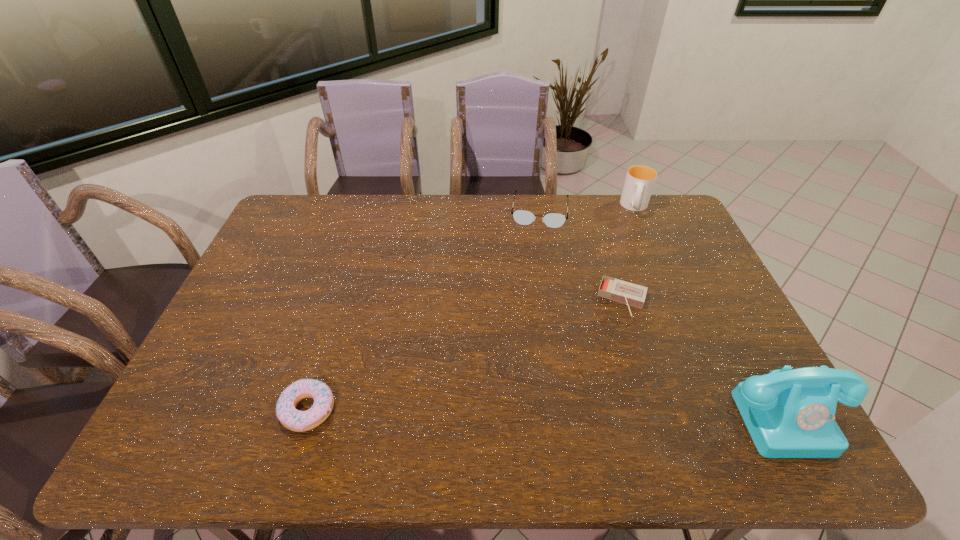
Where is `free space between the fourth shortest object and the telephone`? free space between the fourth shortest object and the telephone is located at coordinates (712, 310).

This screenshot has height=540, width=960. Find the location of `object that ranks as the second closest to the second tallest object`. object that ranks as the second closest to the second tallest object is located at coordinates (628, 293).

You are a GUI agent. You are given a task and a screenshot of the screen. Output one action in this format:
    pyautogui.click(x=<x>, y=<y>)
    Task: Click on the second closest object to the shortest object
    
    Given the screenshot: What is the action you would take?
    click(x=523, y=217)

Locate an element on the screen. The height and width of the screenshot is (540, 960). free space that satisfies the following two spatial constraints: 1. on the back side of the cup; 2. on the left side of the third shortest object is located at coordinates (540, 207).